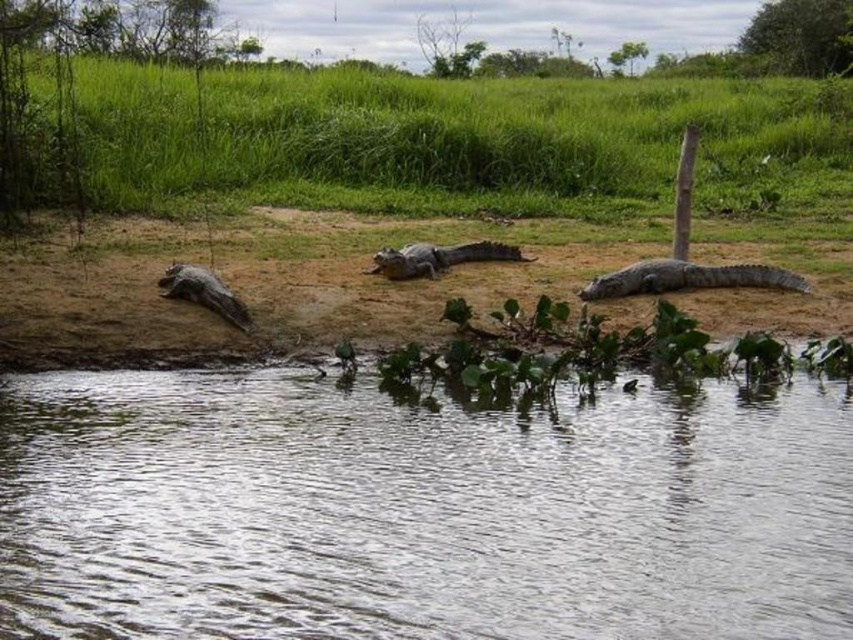
Question: Is gray-green scaly crocodile at center thinner than dark gray scaly crocodile at left?

Choices:
 (A) yes
 (B) no

Answer: (B)

Question: Among these objects, which one is nearest to the camera?

Choices:
 (A) dark gray scaly crocodile at left
 (B) grayish-green scaly crocodile at center

Answer: (A)

Question: Among these objects, which one is farthest from the camera?

Choices:
 (A) dark gray scaly crocodile at left
 (B) gray-green scaly crocodile at center
 (C) green grass at upper center
 (D) grayish-green scaly crocodile at center

Answer: (C)

Question: Is the position of gray-green scaly crocodile at center less distant than that of dark gray scaly crocodile at left?

Choices:
 (A) yes
 (B) no

Answer: (B)

Question: Does grayish-green scaly crocodile at center have a lesser width compared to dark gray scaly crocodile at left?

Choices:
 (A) no
 (B) yes

Answer: (A)

Question: Which object is positioned farthest from the gray-green scaly crocodile at center?

Choices:
 (A) grayish-green scaly crocodile at center
 (B) clear water at lower center
 (C) dark gray scaly crocodile at left
 (D) green grass at upper center

Answer: (D)